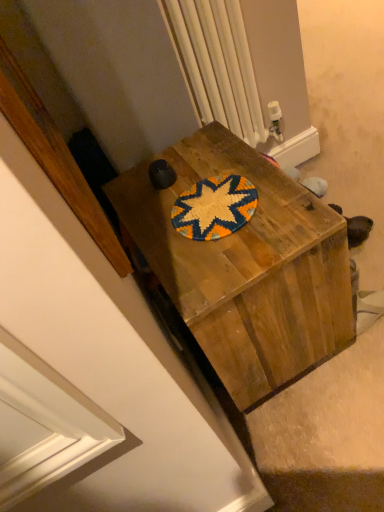
Question: Considering the positions of wooden desk at center and white plastic radiator at upper center in the image, is wooden desk at center bigger or smaller than white plastic radiator at upper center?

Choices:
 (A) big
 (B) small

Answer: (A)

Question: From their relative heights in the image, would you say wooden desk at center is taller or shorter than white plastic radiator at upper center?

Choices:
 (A) short
 (B) tall

Answer: (A)

Question: From the image's perspective, is wooden desk at center positioned above or below white plastic radiator at upper center?

Choices:
 (A) below
 (B) above

Answer: (A)

Question: From the image's perspective, is white plastic radiator at upper center positioned above or below wooden desk at center?

Choices:
 (A) below
 (B) above

Answer: (B)

Question: Is white plastic radiator at upper center situated inside wooden desk at center or outside?

Choices:
 (A) inside
 (B) outside

Answer: (B)

Question: Considering the positions of point (244, 101) and point (284, 205), is point (244, 101) closer or farther from the camera than point (284, 205)?

Choices:
 (A) farther
 (B) closer

Answer: (A)

Question: Is white plastic radiator at upper center wider or thinner than wooden desk at center?

Choices:
 (A) thin
 (B) wide

Answer: (A)